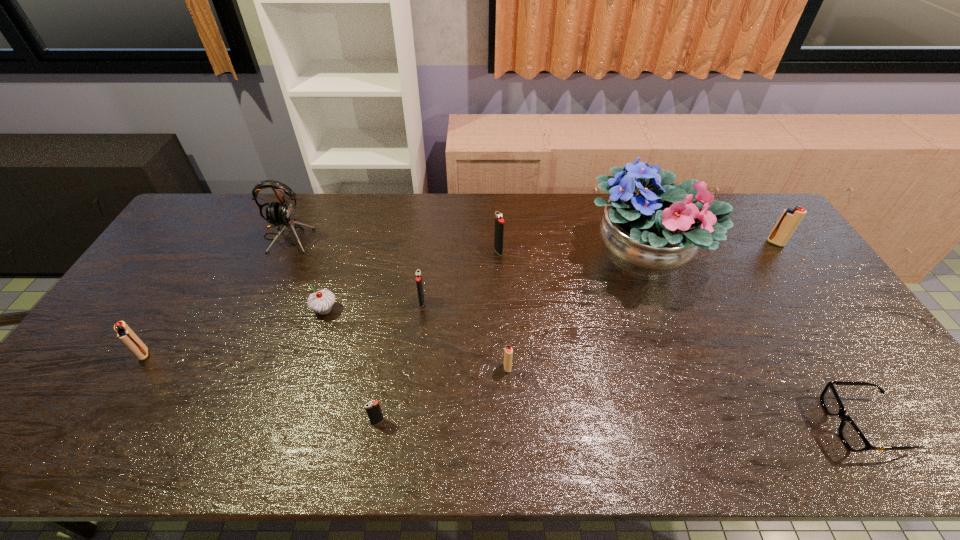
Where is `vacant area situated on the left of the blue bouquet`? The image size is (960, 540). vacant area situated on the left of the blue bouquet is located at coordinates (555, 257).

Where is `vacant space located on the front of the ninth object from right to left`? The width and height of the screenshot is (960, 540). vacant space located on the front of the ninth object from right to left is located at coordinates (250, 320).

Locate an element on the screen. The width and height of the screenshot is (960, 540). free space located 0.260m on the left of the rightmost red igniter is located at coordinates (690, 243).

Locate an element on the screen. vacant region located 0.270m on the right of the biggest black igniter is located at coordinates (585, 251).

Identify the location of vacant space situated on the back of the second biggest black igniter. (425, 271).

Locate an element on the screen. The width and height of the screenshot is (960, 540). free region located 0.210m on the right of the leftmost object is located at coordinates (229, 354).

I want to click on blank area located 0.080m on the back of the gray cupcake, so click(334, 280).

Find the location of a particular element. Image resolution: width=960 pixels, height=540 pixels. vacant area located 0.310m on the left of the smallest red igniter is located at coordinates [383, 367].

At what (x,y) coordinates should I click in order to perform the action: click on vacant space situated 0.260m on the right of the leftmost black igniter. Please return your answer as a coordinate pair (x, y). Image resolution: width=960 pixels, height=540 pixels. Looking at the image, I should click on (494, 422).

This screenshot has height=540, width=960. What are the coordinates of `vacant area situated on the front-facing side of the sunglasses` in the screenshot? It's located at (791, 424).